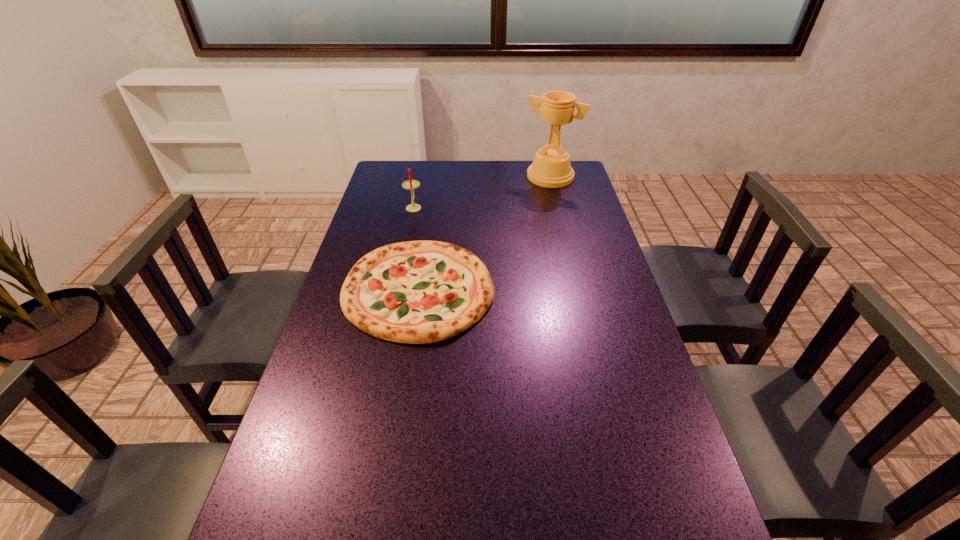
At what (x,y) coordinates should I click in order to perform the action: click on award. Please return your answer as a coordinate pair (x, y). Looking at the image, I should click on (551, 168).

Identify the location of the farthest object. The height and width of the screenshot is (540, 960). (551, 168).

Identify the location of the second tallest object. This screenshot has height=540, width=960. (410, 184).

Locate an element on the screen. This screenshot has height=540, width=960. the second nearest object is located at coordinates (410, 184).

In order to click on pizza in this screenshot , I will do `click(417, 292)`.

What are the coordinates of `the shortest object` in the screenshot? It's located at (417, 292).

The height and width of the screenshot is (540, 960). What are the coordinates of `blank space located 0.160m on the left of the award` in the screenshot? It's located at (486, 177).

You are a GUI agent. You are given a task and a screenshot of the screen. Output one action in this format:
    pyautogui.click(x=<x>, y=<y>)
    Task: Click on the free space located 0.290m on the right of the second nearest object
    
    Given the screenshot: What is the action you would take?
    pyautogui.click(x=499, y=207)

Locate an element on the screen. This screenshot has width=960, height=540. free space located on the back of the nearest object is located at coordinates (431, 211).

Identify the location of object situated at the far edge. This screenshot has height=540, width=960. (551, 168).